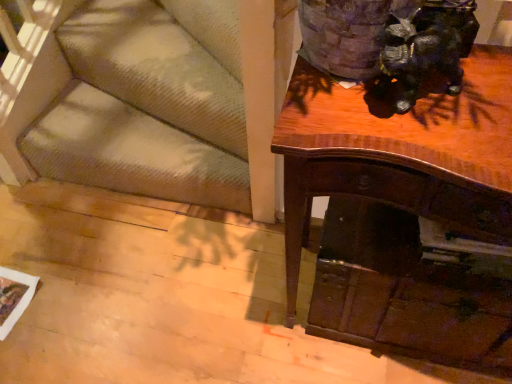
Question: From the image's perspective, is textured beige carpet at lower left located above or below shiny black statue at upper right?

Choices:
 (A) below
 (B) above

Answer: (A)

Question: Is textured beige carpet at lower left spatially inside shiny black statue at upper right, or outside of it?

Choices:
 (A) inside
 (B) outside

Answer: (B)

Question: Estimate the real-world distances between objects in this image. Which object is closer to the shiny brown desk at upper right?

Choices:
 (A) wooden drawer at lower right
 (B) shiny black statue at upper right
 (C) textured beige carpet at lower left

Answer: (A)

Question: Which is farther from the shiny brown desk at upper right?

Choices:
 (A) wooden drawer at lower right
 (B) textured beige carpet at lower left
 (C) shiny black statue at upper right

Answer: (B)